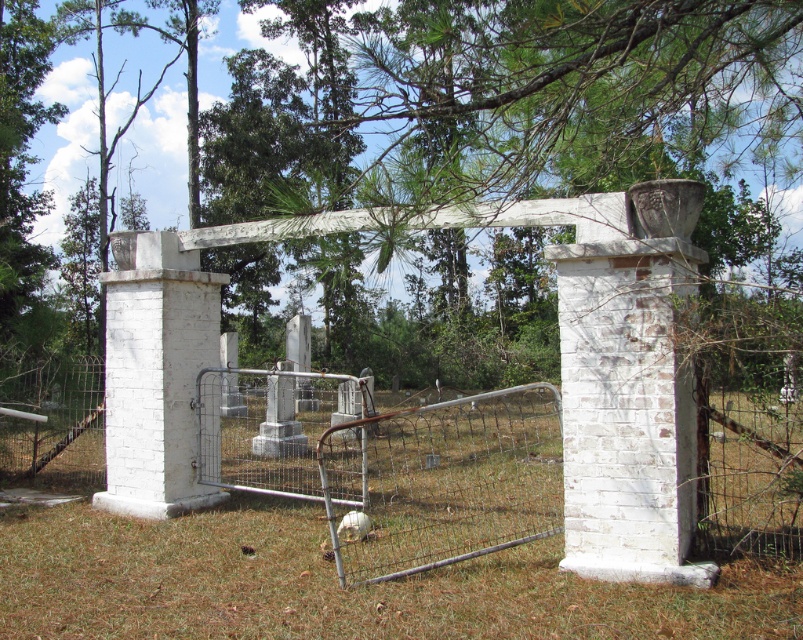
Does brown dry grass at center have a lesser width compared to white painted brick gate at center?

Incorrect, brown dry grass at center's width is not less than white painted brick gate at center's.

Which is in front, point (728, 621) or point (145, 435)?

Point (728, 621) is more forward.

The image size is (803, 640). What do you see at coordinates (335, 586) in the screenshot?
I see `brown dry grass at center` at bounding box center [335, 586].

Find the location of a particular element. brown dry grass at center is located at coordinates (335, 586).

What do you see at coordinates (335, 586) in the screenshot? This screenshot has height=640, width=803. I see `brown dry grass at center` at bounding box center [335, 586].

Does brown dry grass at center appear under white painted brick column at center?

Correct, brown dry grass at center is located below white painted brick column at center.

Where is `brown dry grass at center`? brown dry grass at center is located at coordinates (335, 586).

Can you confirm if white painted brick column at center is positioned to the right of white painted brick gate at center?

Yes, white painted brick column at center is to the right of white painted brick gate at center.

Is white painted brick column at center below white painted brick gate at center?

Yes, white painted brick column at center is below white painted brick gate at center.

This screenshot has width=803, height=640. I want to click on white painted brick column at center, so click(626, 412).